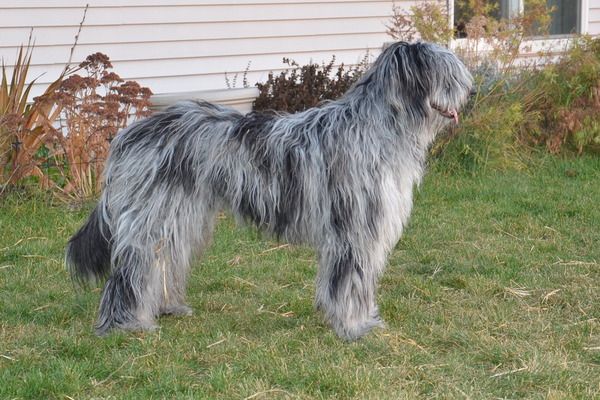
The image size is (600, 400). I want to click on window pane, so click(x=463, y=41), click(x=557, y=45).